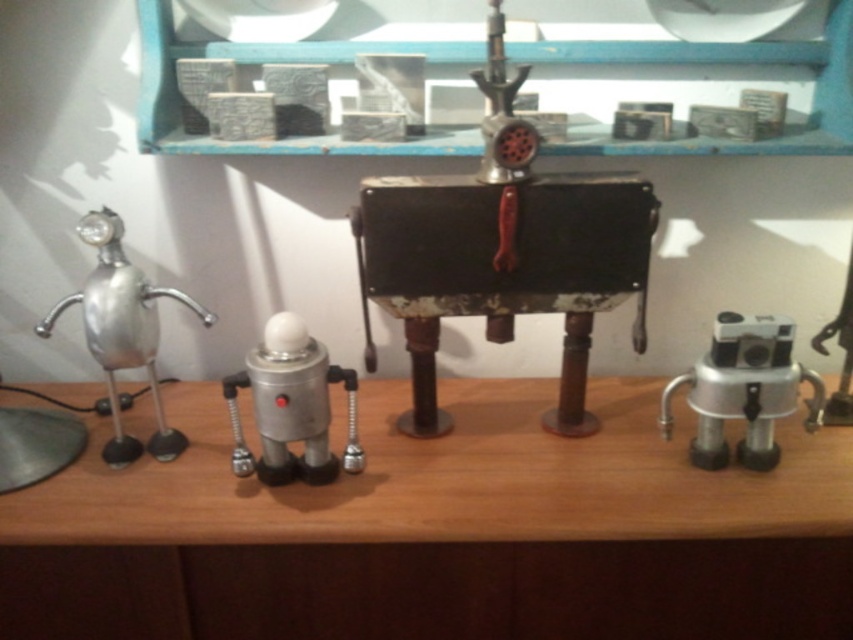
Who is taller, rusty metal meat grinder at center or brushed metal robot at left?

With more height is rusty metal meat grinder at center.

The height and width of the screenshot is (640, 853). Describe the element at coordinates (502, 252) in the screenshot. I see `rusty metal meat grinder at center` at that location.

Locate an element on the screen. Image resolution: width=853 pixels, height=640 pixels. rusty metal meat grinder at center is located at coordinates (502, 252).

Does metallic silver robot at right have a lesser height compared to metallic silver robot at center?

Yes, metallic silver robot at right is shorter than metallic silver robot at center.

Does metallic silver robot at right have a greater height compared to metallic silver robot at center?

No.

Where is `metallic silver robot at right`? The image size is (853, 640). metallic silver robot at right is located at coordinates (743, 388).

Does rusty metal meat grinder at center appear under metallic silver robot at center?

No.

Between rusty metal meat grinder at center and metallic silver robot at center, which one is positioned lower?

metallic silver robot at center is below.

You are a GUI agent. You are given a task and a screenshot of the screen. Output one action in this format:
    pyautogui.click(x=<x>, y=<y>)
    Task: Click on the rusty metal meat grinder at center
    The height and width of the screenshot is (640, 853).
    Given the screenshot: What is the action you would take?
    pyautogui.click(x=502, y=252)